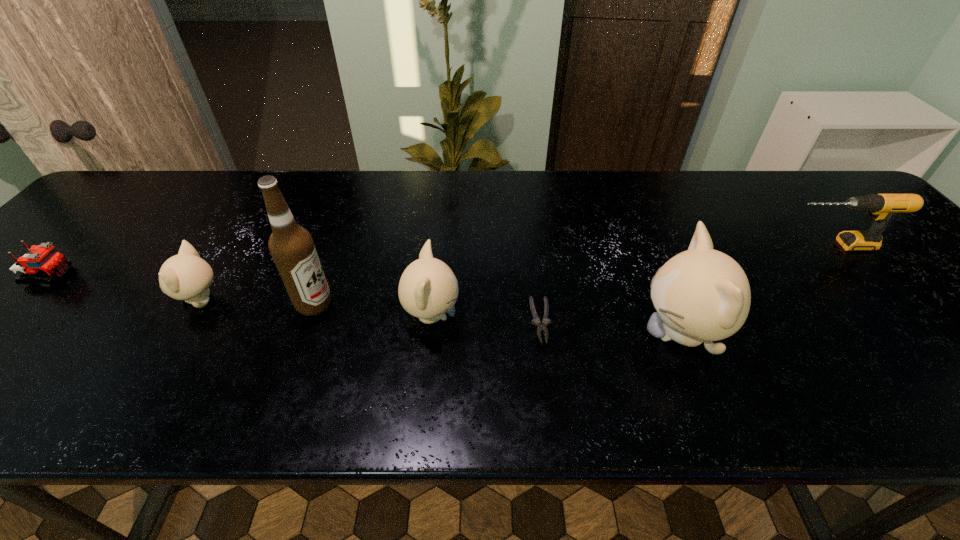
What are the coordinates of `the leftmost kitten` in the screenshot? It's located at (186, 276).

This screenshot has width=960, height=540. Identify the location of the sixth object from right to left. (186, 276).

Find the location of a particular element. The width and height of the screenshot is (960, 540). the second shortest kitten is located at coordinates (428, 288).

This screenshot has width=960, height=540. Identify the location of the fourth object from right to left. (428, 288).

The width and height of the screenshot is (960, 540). Identify the location of the rightmost kitten. (701, 295).

Where is `the sixth shortest object`? the sixth shortest object is located at coordinates (701, 295).

I want to click on the second shortest object, so click(42, 261).

Locate an element on the screen. This screenshot has height=540, width=960. Lego is located at coordinates (42, 261).

Image resolution: width=960 pixels, height=540 pixels. I want to click on drill, so click(881, 206).

Identify the location of the farthest object. The width and height of the screenshot is (960, 540). (881, 206).